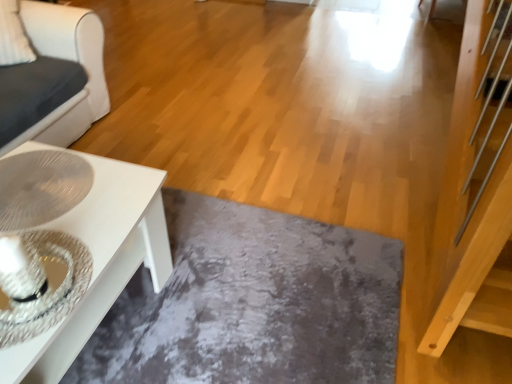
At what (x,y) coordinates should I click in order to perform the action: click on free point to the right of white glossy table at lower left. Please return your answer as a coordinate pair (x, y). Looking at the image, I should click on (237, 301).